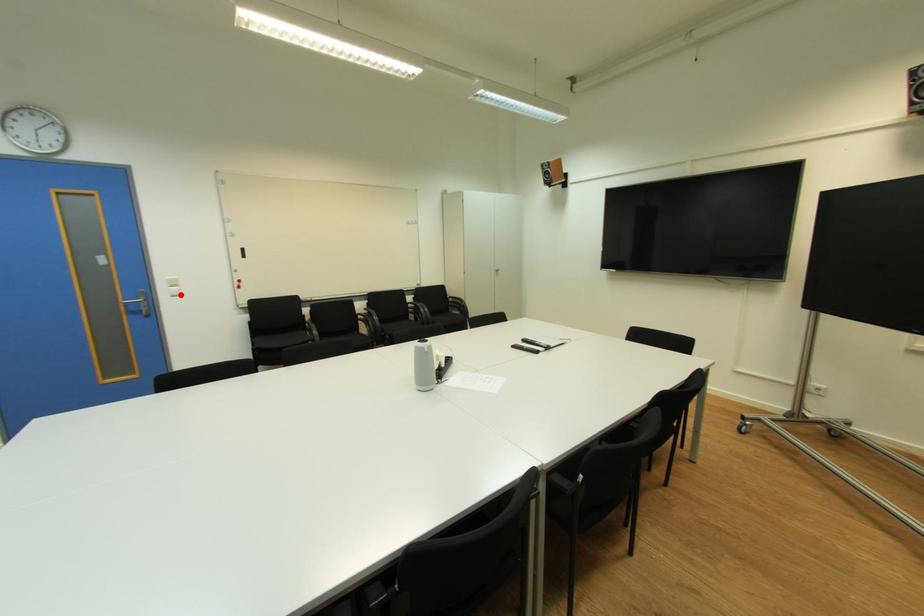
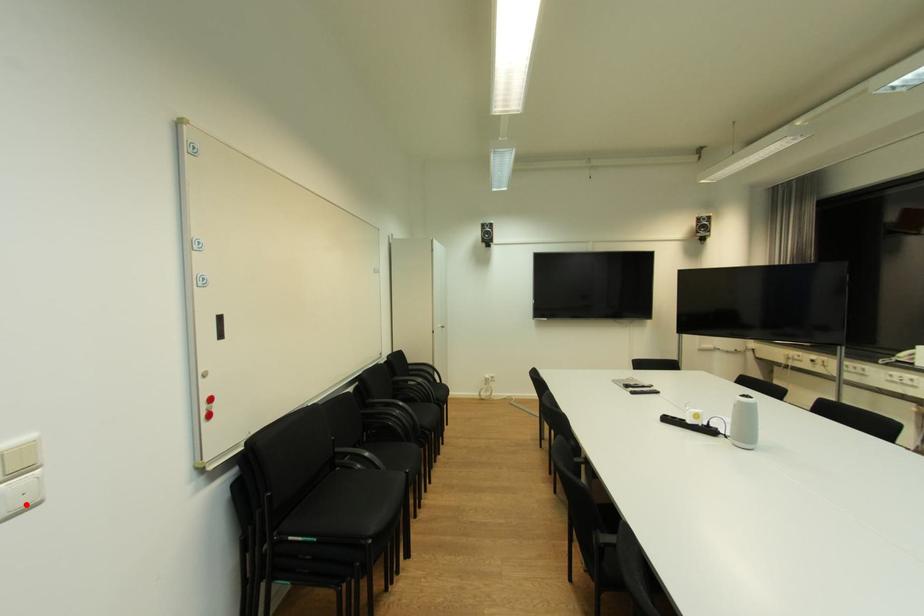
Consider the image. I am providing you with two images of the same scene from different viewpoints. A red point is marked on the first image and another point is marked on the second image. Is the marked point in image1 the same physical position as the marked point in image2?

Yes